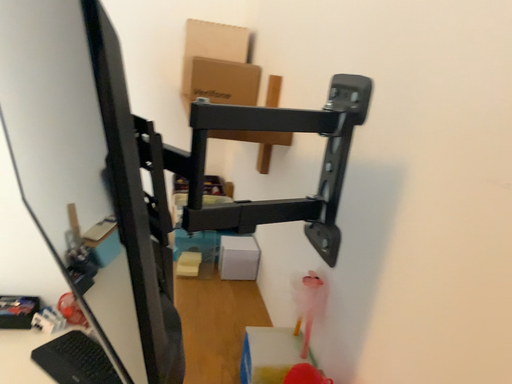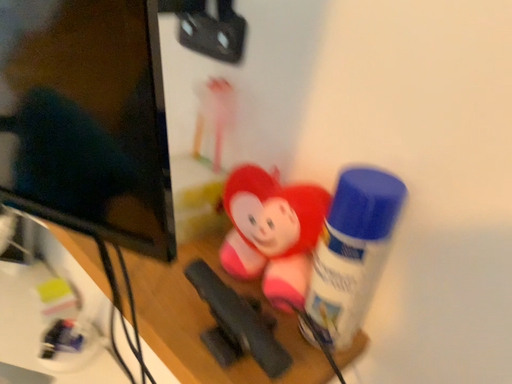
Question: How did the camera likely rotate when shooting the video?

Choices:
 (A) rotated right
 (B) rotated left

Answer: (A)